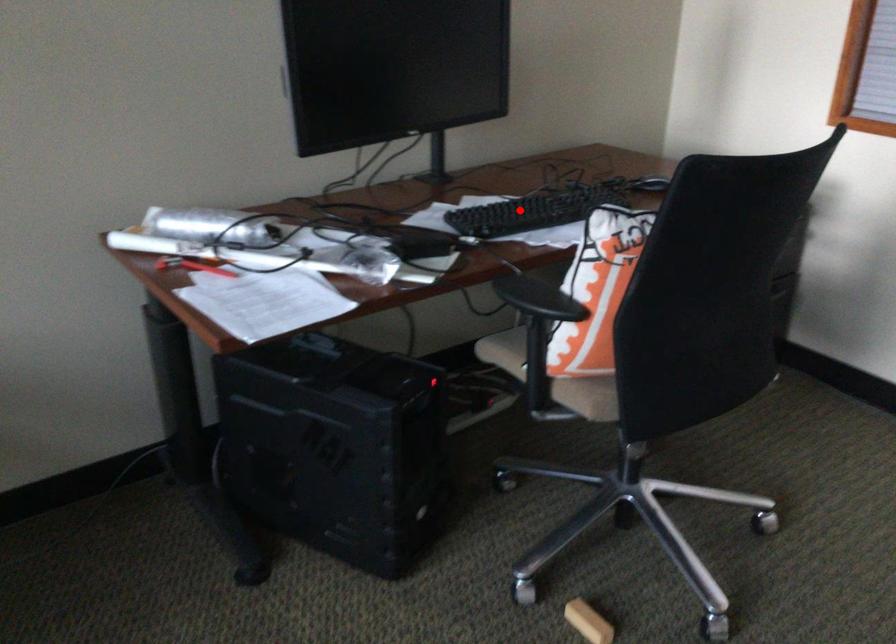
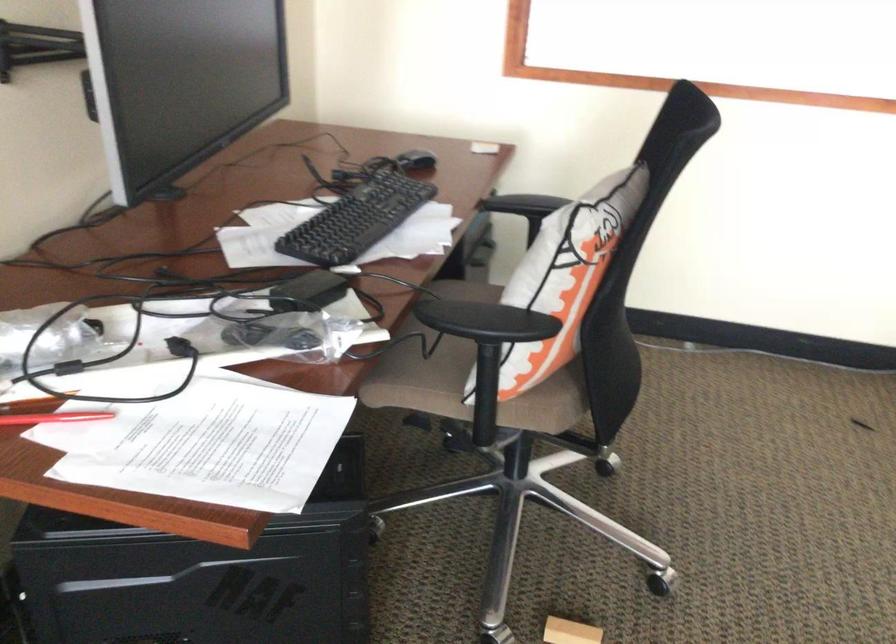
Question: I am providing you with two images of the same scene from different viewpoints. In image1, a red point is highlighted. Considering the same 3D point in image2, which of the following is correct?

Choices:
 (A) It is closer
 (B) It is farther

Answer: (A)